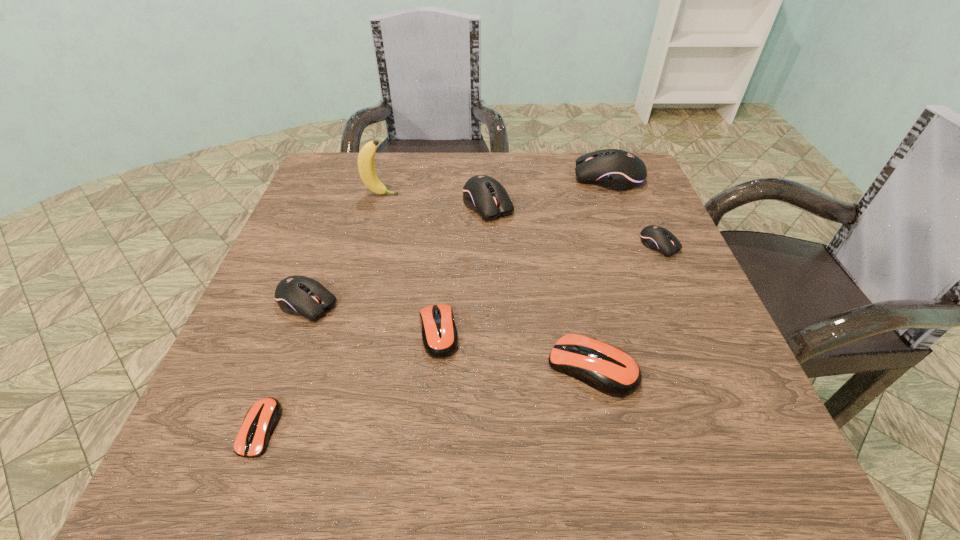
In the image, there is a desktop. Find the location of `vacant space at the right edge`. vacant space at the right edge is located at coordinates (591, 205).

The width and height of the screenshot is (960, 540). I want to click on free space at the far right corner of the desktop, so click(x=589, y=199).

Locate an element on the screen. This screenshot has height=540, width=960. empty space between the nearest black computer mouse and the second orange computer mouse from right to left is located at coordinates (372, 318).

Identify the location of free space that is in between the biggest black computer mouse and the smallest black computer mouse. This screenshot has width=960, height=540. (634, 212).

Image resolution: width=960 pixels, height=540 pixels. I want to click on unoccupied position between the leftmost orange computer mouse and the second smallest black computer mouse, so click(284, 366).

Locate an element on the screen. The height and width of the screenshot is (540, 960). free space between the leftmost orange computer mouse and the third smallest black computer mouse is located at coordinates (374, 316).

You are a GUI agent. You are given a task and a screenshot of the screen. Output one action in this format:
    pyautogui.click(x=<x>, y=<y>)
    Task: Click on the blank region between the smallest black computer mouse and the tallest object
    Image resolution: width=960 pixels, height=540 pixels.
    Given the screenshot: What is the action you would take?
    pyautogui.click(x=520, y=220)

You are a GUI agent. You are given a task and a screenshot of the screen. Output one action in this format:
    pyautogui.click(x=<x>, y=<y>)
    Task: Click on the free point between the tallest computer mouse and the third tallest object
    The height and width of the screenshot is (540, 960).
    Given the screenshot: What is the action you would take?
    pyautogui.click(x=548, y=192)

Identify the location of vacant space that's between the leftmost black computer mouse and the shortest computer mouse. (284, 366).

Identify the location of blank region between the third black computer mouse from right to left and the tallest object. The height and width of the screenshot is (540, 960). (434, 200).